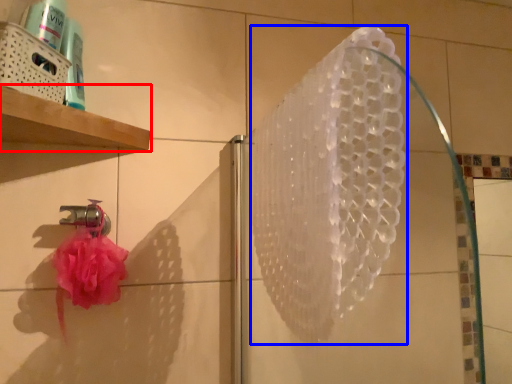
Question: Which object appears farthest to the camera in this image, shelf (highlighted by a red box) or shower (highlighted by a blue box)?

Choices:
 (A) shelf
 (B) shower

Answer: (A)